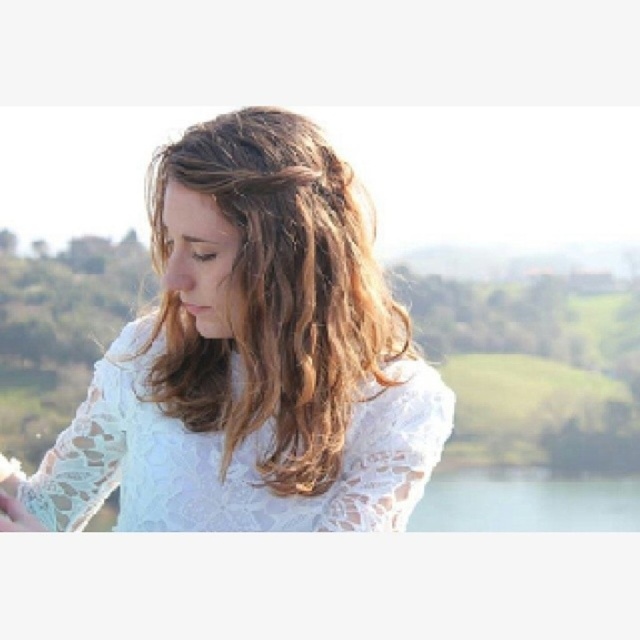
You are a photographer planning to capture a closeup shot of the white lace dress at center and the transparent glass lake at bottom. Given their sizes, which object should you focus on to ensure both are visible in the frame without needing to zoom in or out?

Since the white lace dress at center occupies less space than the transparent glass lake at bottom, you should focus on the transparent glass lake at bottom to ensure both fit in the frame without needing to adjust the zoom.

You are standing in the countryside scene and want to place a small flag at the point that is closer to you. Which point should you choose between point (404, 355) and point (588, 499)?

Point (404, 355) is closer to the viewer than point (588, 499), so you should choose point (404, 355) to place the small flag.

Based on the coordinates provided in the scene description, where is the white lace shirt at center located?

The white lace shirt at center is located at point (250, 358).